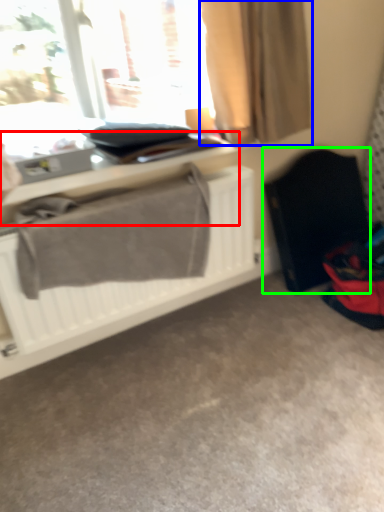
Question: Which is nearer to the table (highlighted by a red box)? curtain (highlighted by a blue box) or folding chair (highlighted by a green box).

Choices:
 (A) curtain
 (B) folding chair

Answer: (A)